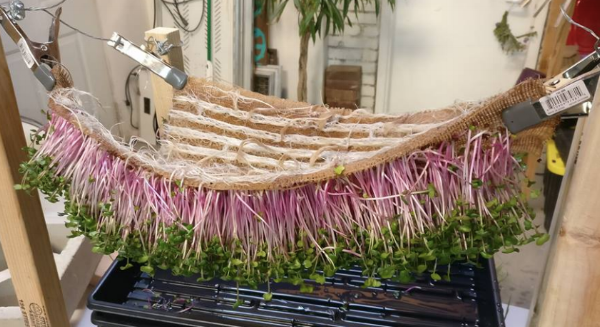
I want to click on floor, so click(515, 318).